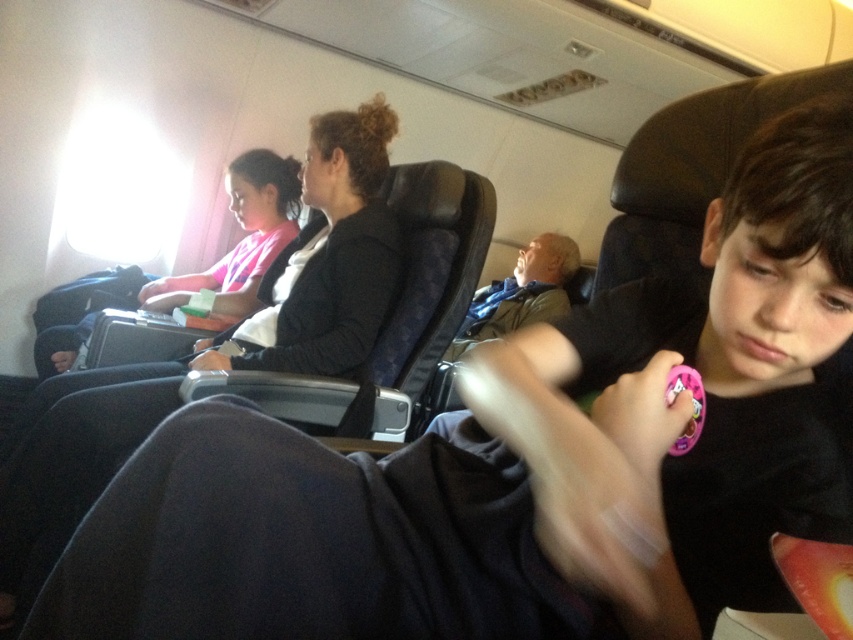
You are a flight attendant on an airplane. You need to locate a pink item to give to a child. You see the pink fabric shirt at left and the pink plastic toy at lower right. Which item is higher up?

The pink fabric shirt at left is above the pink plastic toy at lower right, so the pink fabric shirt at left is higher up.

You are sitting in an airplane seat and want to reach for a snack that is at point (242,186) and a drink at point (669,448). Which item will you reach first?

You will reach the snack at point (242,186) first because it is closer to you than the drink at point (669,448).